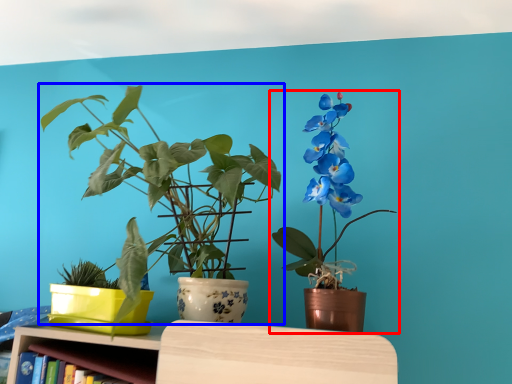
Question: Which object is closer to the camera taking this photo, houseplant (highlighted by a red box) or houseplant (highlighted by a blue box)?

Choices:
 (A) houseplant
 (B) houseplant

Answer: (B)